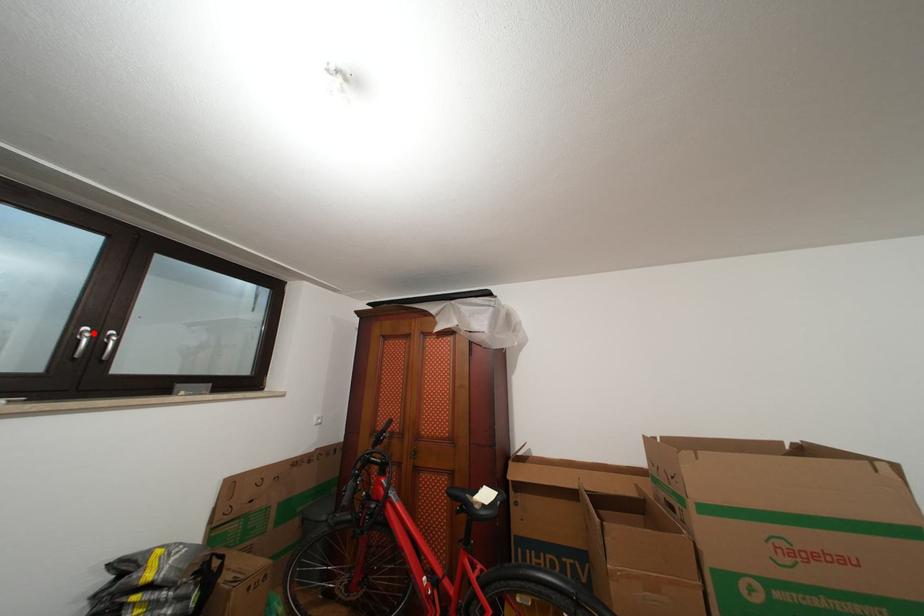
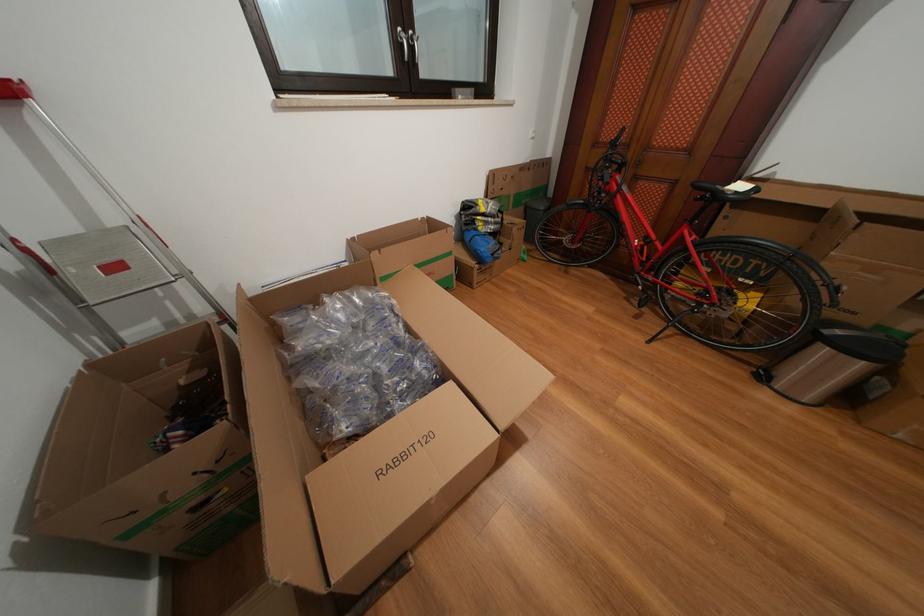
Find the pixel in the second image that matches the highlighted location in the first image.

(407, 34)